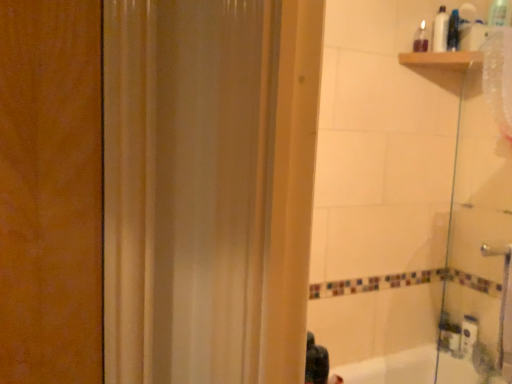
Question: Considering the relative sizes of white plastic bottle at upper right, acting as the 2th toiletry starting from the right, and translucent plastic bottle at upper right, positioned as the third toiletry in left-to-right order, in the image provided, is white plastic bottle at upper right, acting as the 2th toiletry starting from the right, wider than translucent plastic bottle at upper right, positioned as the third toiletry in left-to-right order,?

Choices:
 (A) yes
 (B) no

Answer: (B)

Question: Is translucent plastic bottle at upper right, positioned as the third toiletry in left-to-right order, at the back of white plastic bottle at upper right, acting as the 2th toiletry starting from the right?

Choices:
 (A) yes
 (B) no

Answer: (B)

Question: Does white plastic bottle at upper right, the second toiletry when ordered from left to right, have a lesser height compared to translucent plastic bottle at upper right, positioned as the third toiletry in left-to-right order?

Choices:
 (A) yes
 (B) no

Answer: (B)

Question: Is white plastic bottle at upper right, acting as the 2th toiletry starting from the right, to the left of translucent plastic bottle at upper right, positioned as the third toiletry in left-to-right order, from the viewer's perspective?

Choices:
 (A) yes
 (B) no

Answer: (A)

Question: Can we say white plastic bottle at upper right, the second toiletry when ordered from left to right, lies outside translucent plastic bottle at upper right, positioned as the third toiletry in left-to-right order?

Choices:
 (A) yes
 (B) no

Answer: (A)

Question: Looking at their shapes, would you say white plastic bottle at upper right, the second toiletry when ordered from left to right, is wider or thinner than black matte hair at lower center?

Choices:
 (A) wide
 (B) thin

Answer: (A)

Question: In the image, is white plastic bottle at upper right, the second toiletry when ordered from left to right, on the left side or the right side of black matte hair at lower center?

Choices:
 (A) right
 (B) left

Answer: (A)

Question: Does point (437, 51) appear closer or farther from the camera than point (315, 360)?

Choices:
 (A) farther
 (B) closer

Answer: (A)

Question: Considering their positions, is white plastic bottle at upper right, the second toiletry when ordered from left to right, located in front of or behind black matte hair at lower center?

Choices:
 (A) behind
 (B) front

Answer: (A)

Question: In the image, is white plastic bottle at upper right, acting as the 2th toiletry starting from the right, on the left side or the right side of transparent glass shower door at right?

Choices:
 (A) left
 (B) right

Answer: (B)

Question: Would you say white plastic bottle at upper right, acting as the 2th toiletry starting from the right, is inside or outside transparent glass shower door at right?

Choices:
 (A) outside
 (B) inside

Answer: (A)

Question: From the image's perspective, relative to transparent glass shower door at right, is white plastic bottle at upper right, acting as the 2th toiletry starting from the right, above or below?

Choices:
 (A) below
 (B) above

Answer: (B)

Question: In the image, is white plastic bottle at upper right, acting as the 2th toiletry starting from the right, positioned in front of or behind transparent glass shower door at right?

Choices:
 (A) front
 (B) behind

Answer: (B)

Question: Would you say black matte hair at lower center is inside or outside white plastic bottle at upper right, acting as the 2th toiletry starting from the right?

Choices:
 (A) outside
 (B) inside

Answer: (A)

Question: From the image's perspective, relative to white plastic bottle at upper right, acting as the 2th toiletry starting from the right, is black matte hair at lower center above or below?

Choices:
 (A) below
 (B) above

Answer: (A)